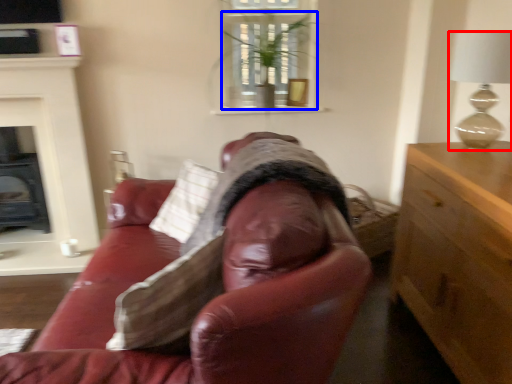
Question: Among these objects, which one is farthest to the camera, lamp (highlighted by a red box) or houseplant (highlighted by a blue box)?

Choices:
 (A) lamp
 (B) houseplant

Answer: (B)